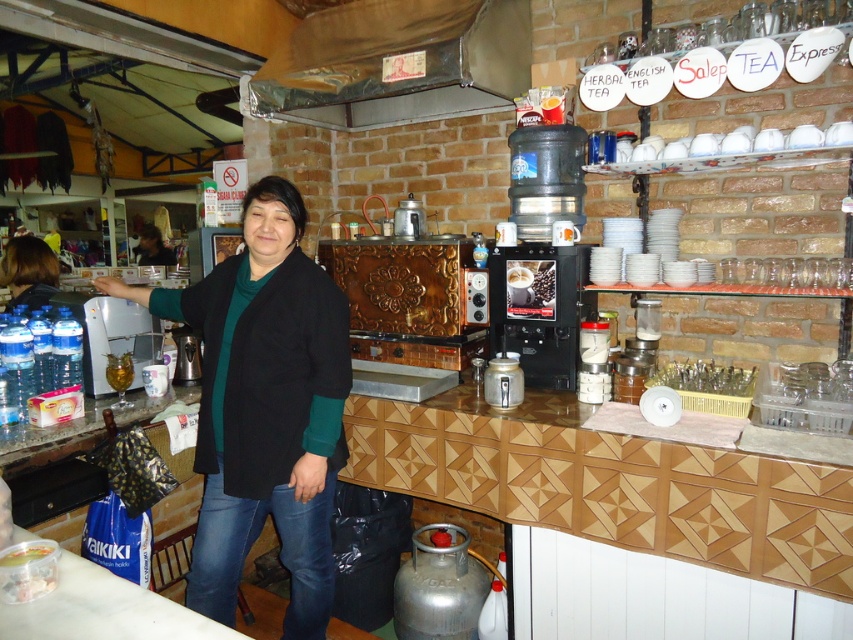
Question: Which object appears farthest from the camera in this image?

Choices:
 (A) blonde hair at upper left
 (B) silver metallic exhaust hood at upper center

Answer: (A)

Question: Does blonde hair at upper left have a larger size compared to translucent plastic bag at lower left?

Choices:
 (A) yes
 (B) no

Answer: (A)

Question: Which object appears closest to the camera in this image?

Choices:
 (A) blonde hair at upper left
 (B) silver metallic exhaust hood at upper center

Answer: (B)

Question: Which point is closer to the camera?

Choices:
 (A) (189, 602)
 (B) (16, 292)
 (C) (3, 595)

Answer: (C)

Question: Is silver metallic exhaust hood at upper center closer to the viewer compared to translucent plastic bag at lower left?

Choices:
 (A) no
 (B) yes

Answer: (A)

Question: Does silver metallic exhaust hood at upper center come in front of translucent plastic bag at lower left?

Choices:
 (A) yes
 (B) no

Answer: (B)